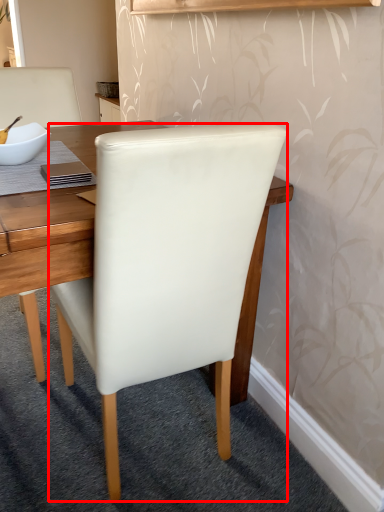
Question: Considering the relative positions of chair (annotated by the red box) and bowl in the image provided, where is chair (annotated by the red box) located with respect to the staircase?

Choices:
 (A) left
 (B) right

Answer: (B)